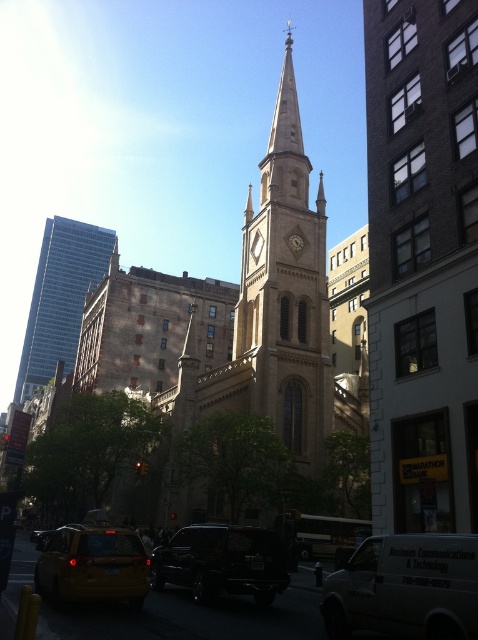
Question: Which point is closer to the camera?

Choices:
 (A) (67, 296)
 (B) (260, 529)
 (C) (36, 566)

Answer: (C)

Question: Can you confirm if white matte van at center is positioned to the right of blue glass skyscraper at left?

Choices:
 (A) yes
 (B) no

Answer: (A)

Question: Among these points, which one is nearest to the camera?

Choices:
 (A) (340, 397)
 (B) (161, 548)
 (C) (382, 564)

Answer: (C)

Question: Based on their relative distances, which object is nearer to the brown stone clock tower at center?

Choices:
 (A) white matte van at center
 (B) blue glass skyscraper at left
 (C) shiny black suv at center

Answer: (C)

Question: Can you confirm if blue glass skyscraper at left is positioned to the right of shiny black suv at center?

Choices:
 (A) yes
 (B) no

Answer: (B)

Question: Is the position of white matte van at center more distant than that of blue glass skyscraper at left?

Choices:
 (A) no
 (B) yes

Answer: (A)